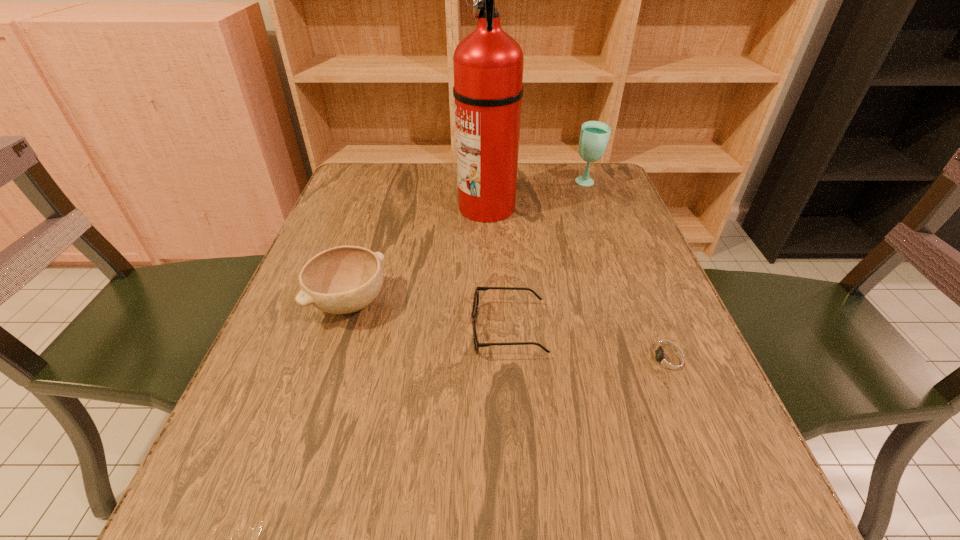
Find the location of a particular element. The image size is (960, 540). empty location between the second tallest object and the tallest object is located at coordinates (537, 195).

I want to click on free space between the bowl and the tallest object, so pos(419,255).

Identify the location of empty space that is in between the fourth tallest object and the leftmost object. (429, 317).

The height and width of the screenshot is (540, 960). In order to click on free space between the fire extinguisher and the second shortest object in this screenshot , I will do 497,268.

Locate an element on the screen. vacant area that lies between the tallest object and the bowl is located at coordinates (419, 255).

This screenshot has width=960, height=540. I want to click on free spot between the shortest object and the second shortest object, so click(x=588, y=345).

Find the location of `vacant point located between the shortest object and the second shortest object`. vacant point located between the shortest object and the second shortest object is located at coordinates (588, 345).

Locate an element on the screen. vacant area that lies between the watch and the spectacles is located at coordinates (588, 345).

Identify the location of free space between the bowl and the shortest object. (510, 332).

Identify which object is the second nearest to the fire extinguisher. Please provide its 2D coordinates. Your answer should be formatted as a tuple, i.e. [(x, y)], where the tuple contains the x and y coordinates of a point satisfying the conditions above.

[(344, 279)]